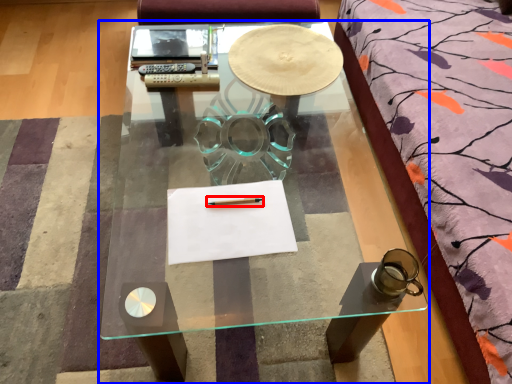
Question: Which object appears farthest to the camera in this image, pencil (highlighted by a red box) or coffee table (highlighted by a blue box)?

Choices:
 (A) pencil
 (B) coffee table

Answer: (B)